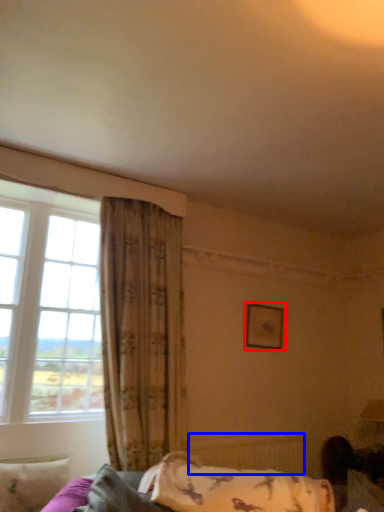
Question: Which of the following is the closest to the observer, picture frame (highlighted by a red box) or radiator (highlighted by a blue box)?

Choices:
 (A) picture frame
 (B) radiator

Answer: (B)